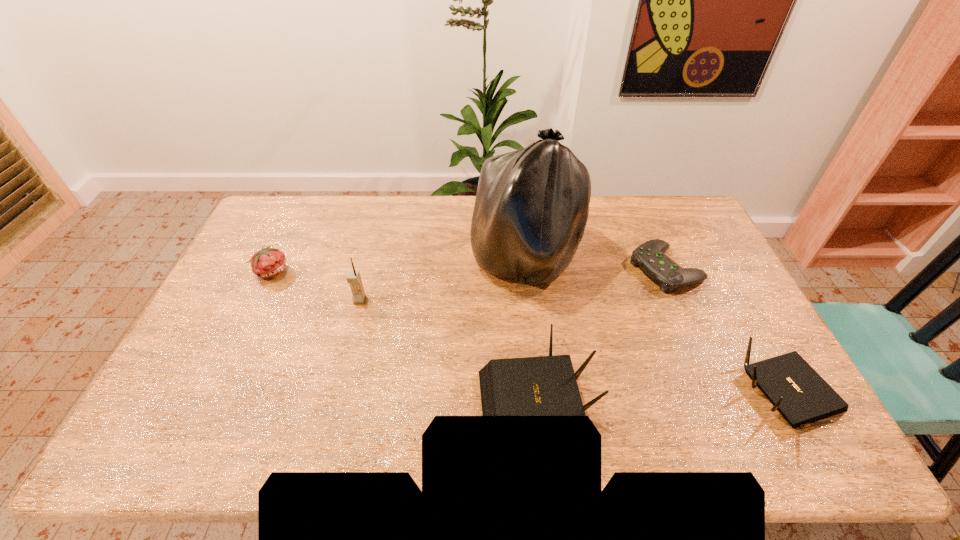
The width and height of the screenshot is (960, 540). Find the location of `the taller router`. the taller router is located at coordinates (545, 385).

You are a GUI agent. You are given a task and a screenshot of the screen. Output one action in this format:
    pyautogui.click(x=<x>, y=<y>)
    Task: Click on the fourth shortest object
    The image size is (960, 540).
    Given the screenshot: What is the action you would take?
    pyautogui.click(x=545, y=385)

Locate an element on the screen. Image resolution: width=960 pixels, height=540 pixels. the shorter router is located at coordinates (796, 390).

Find the location of `the right router`. the right router is located at coordinates (796, 390).

I want to click on the shortest object, so click(649, 256).

In order to click on the tallest object in this screenshot , I will do `click(531, 209)`.

The height and width of the screenshot is (540, 960). What are the coordinates of `the second shortest object` in the screenshot? It's located at (268, 262).

This screenshot has height=540, width=960. I want to click on the leftmost object, so click(x=268, y=262).

I want to click on the second object from left to right, so click(x=353, y=277).

Identify the location of cellular telephone. (353, 277).